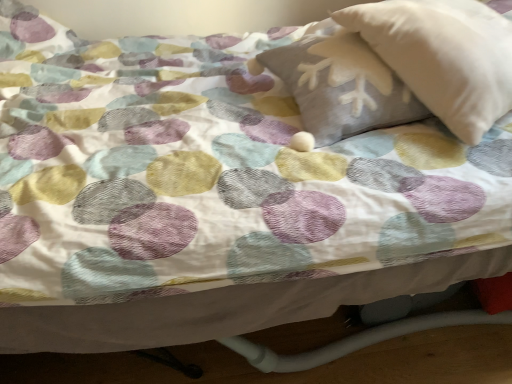
What do you see at coordinates (443, 56) in the screenshot?
I see `white soft pillow at upper right` at bounding box center [443, 56].

The width and height of the screenshot is (512, 384). Find the location of `white soft pillow at upper right`. white soft pillow at upper right is located at coordinates pyautogui.click(x=443, y=56).

Locate an element on the screen. white soft pillow at upper right is located at coordinates (443, 56).